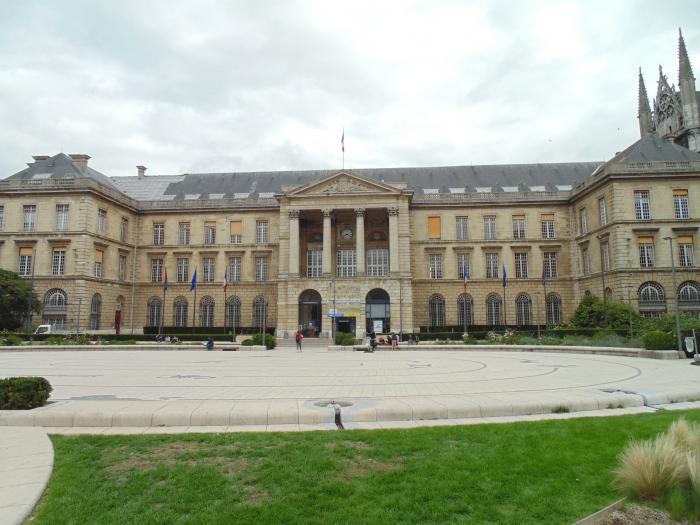
Where is `clock`? clock is located at coordinates (346, 232).